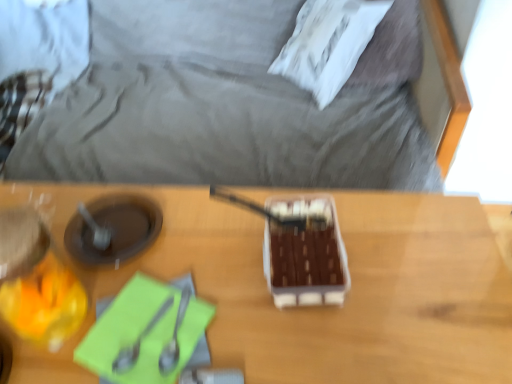
This screenshot has width=512, height=384. What are the coordinates of `spots to the right of satin silver spoon at lower left, which is the second utensil in right-to-left order` in the screenshot? It's located at (241, 321).